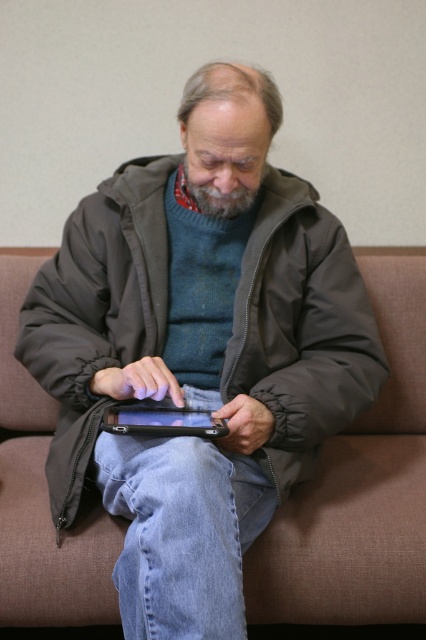
Question: Is black glossy tablet at center below gray/soft hair at center?

Choices:
 (A) yes
 (B) no

Answer: (A)

Question: Which of the following is the farthest from the observer?

Choices:
 (A) click(x=106, y=413)
 (B) click(x=256, y=195)

Answer: (B)

Question: Can you confirm if black glossy tablet at center is thinner than gray/soft hair at center?

Choices:
 (A) yes
 (B) no

Answer: (B)

Question: Can you confirm if black glossy tablet at center is thinner than gray/soft hair at center?

Choices:
 (A) yes
 (B) no

Answer: (B)